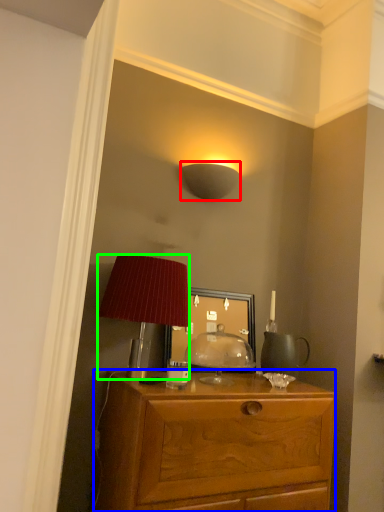
Question: Which object is the closest to the lamp (highlighted by a red box)? Choose among these: desk (highlighted by a blue box) or lamp (highlighted by a green box).

Choices:
 (A) desk
 (B) lamp

Answer: (B)